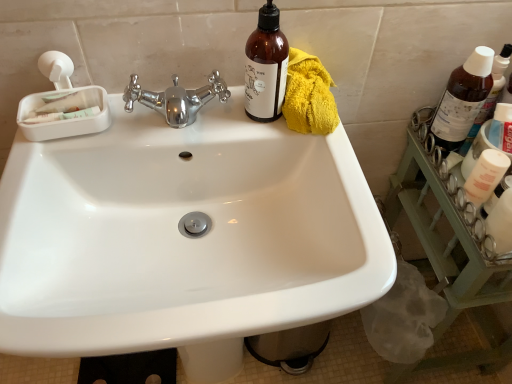
Question: Is the surface of white glossy sink at center in direct contact with yellow fluffy towel at upper right?

Choices:
 (A) no
 (B) yes

Answer: (A)

Question: Can you confirm if white glossy sink at center is wider than yellow fluffy towel at upper right?

Choices:
 (A) no
 (B) yes

Answer: (B)

Question: From a real-world perspective, is white glossy sink at center over yellow fluffy towel at upper right?

Choices:
 (A) yes
 (B) no

Answer: (B)

Question: Is there a large distance between white glossy sink at center and yellow fluffy towel at upper right?

Choices:
 (A) yes
 (B) no

Answer: (B)

Question: From a real-world perspective, is white glossy sink at center located beneath yellow fluffy towel at upper right?

Choices:
 (A) no
 (B) yes

Answer: (B)

Question: From the image's perspective, is brown glass bottle at upper right, marked as the third bottle in a left-to-right arrangement, above or below brown glass bottle at upper right, marked as the 2th bottle in a right-to-left arrangement?

Choices:
 (A) below
 (B) above

Answer: (B)

Question: From a real-world perspective, relative to brown glass bottle at upper right, the second bottle positioned from the left, is brown glass bottle at upper right, marked as the third bottle in a left-to-right arrangement, vertically above or below?

Choices:
 (A) below
 (B) above

Answer: (A)

Question: Looking at the image, does brown glass bottle at upper right, placed as the first bottle when sorted from right to left, seem bigger or smaller compared to brown glass bottle at upper right, the second bottle positioned from the left?

Choices:
 (A) small
 (B) big

Answer: (A)

Question: Is brown glass bottle at upper right, placed as the first bottle when sorted from right to left, inside or outside of brown glass bottle at upper right, marked as the 2th bottle in a right-to-left arrangement?

Choices:
 (A) outside
 (B) inside

Answer: (A)

Question: Is white glossy sink at center inside the boundaries of brown glass bottle at upper right, placed as the first bottle when sorted from right to left, or outside?

Choices:
 (A) inside
 (B) outside

Answer: (B)

Question: In the image, is white glossy sink at center positioned in front of or behind brown glass bottle at upper right, marked as the third bottle in a left-to-right arrangement?

Choices:
 (A) behind
 (B) front

Answer: (B)

Question: In terms of width, does white glossy sink at center look wider or thinner when compared to brown glass bottle at upper right, marked as the third bottle in a left-to-right arrangement?

Choices:
 (A) wide
 (B) thin

Answer: (A)

Question: Is white glossy sink at center taller or shorter than brown glass bottle at upper right, marked as the third bottle in a left-to-right arrangement?

Choices:
 (A) short
 (B) tall

Answer: (B)

Question: Do you think white glossy sink at center is within yellow fluffy towel at upper right, or outside of it?

Choices:
 (A) inside
 (B) outside

Answer: (B)

Question: Considering the positions of white glossy sink at center and yellow fluffy towel at upper right in the image, is white glossy sink at center wider or thinner than yellow fluffy towel at upper right?

Choices:
 (A) wide
 (B) thin

Answer: (A)